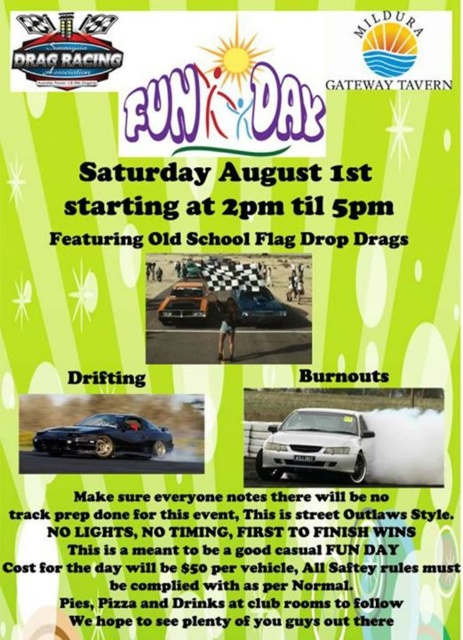
Which is behind, point (106, 444) or point (189, 310)?

The point (189, 310) is behind.

Who is positioned more to the left, shiny black car at center or orange matte car at center?

shiny black car at center

Does point (137, 440) lie behind point (189, 307)?

No, (137, 440) is in front of (189, 307).

Locate an element on the screen. shiny black car at center is located at coordinates (106, 436).

Does white matte sedan at center have a lesser height compared to orange matte car at center?

No, white matte sedan at center is not shorter than orange matte car at center.

Does point (300, 436) come closer to viewer compared to point (177, 321)?

Yes.

Locate an element on the screen. The height and width of the screenshot is (640, 463). white matte sedan at center is located at coordinates (318, 444).

The image size is (463, 640). Find the location of `checkered fabric race track at center`. checkered fabric race track at center is located at coordinates (181, 317).

Between checkered fabric race track at center and shiny black car at center, which one is positioned lower?

Positioned lower is shiny black car at center.

Who is more distant from viewer, (201, 308) or (151, 449)?

Point (201, 308)

This screenshot has height=640, width=463. In order to click on checkered fabric race track at center in this screenshot , I will do `click(181, 317)`.